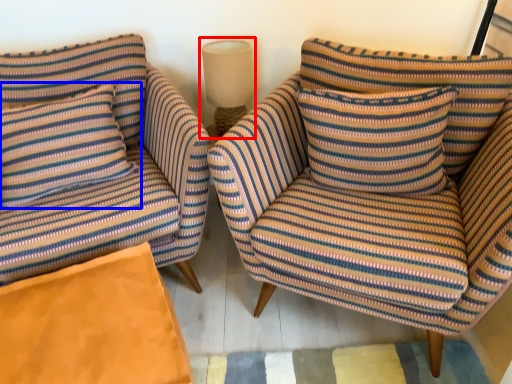
Question: Among these objects, which one is farthest to the camera, lamp (highlighted by a red box) or pillow (highlighted by a blue box)?

Choices:
 (A) lamp
 (B) pillow

Answer: (A)